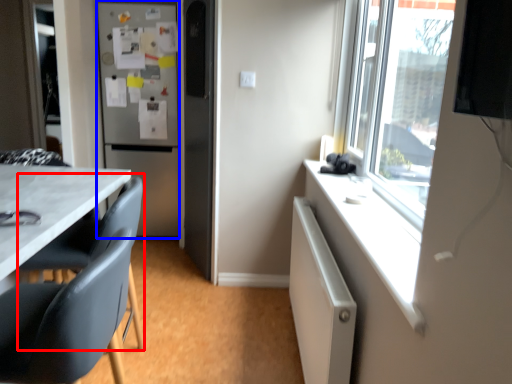
Question: Which object appears farthest to the camera in this image, swivel chair (highlighted by a red box) or refrigerator (highlighted by a blue box)?

Choices:
 (A) swivel chair
 (B) refrigerator

Answer: (B)